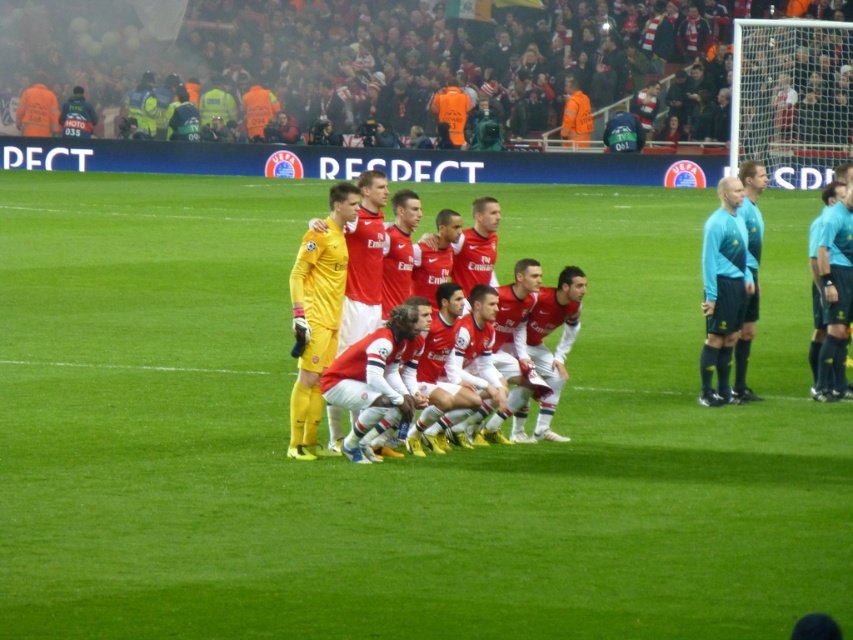
You are a photographer taking a picture of the soccer team. You notice the green grass football field at center and the light blue jersey at center. Which object is closer to the camera?

The light blue jersey at center is closer to the camera because the green grass football field at center is below it.

What are the coordinates of the green grass football field at center?

The coordinates of the green grass football field at center are at point (399,458).

You are a photographer standing at the edge of the field. You want to take a photo that includes both the green grass football field at center and the light blue jersey at center. Based on their positions, which object should you pan your camera to first to ensure both are in frame?

The green grass football field at center is to the left of the light blue jersey at center, so you should pan your camera to the left first to include both in the frame.